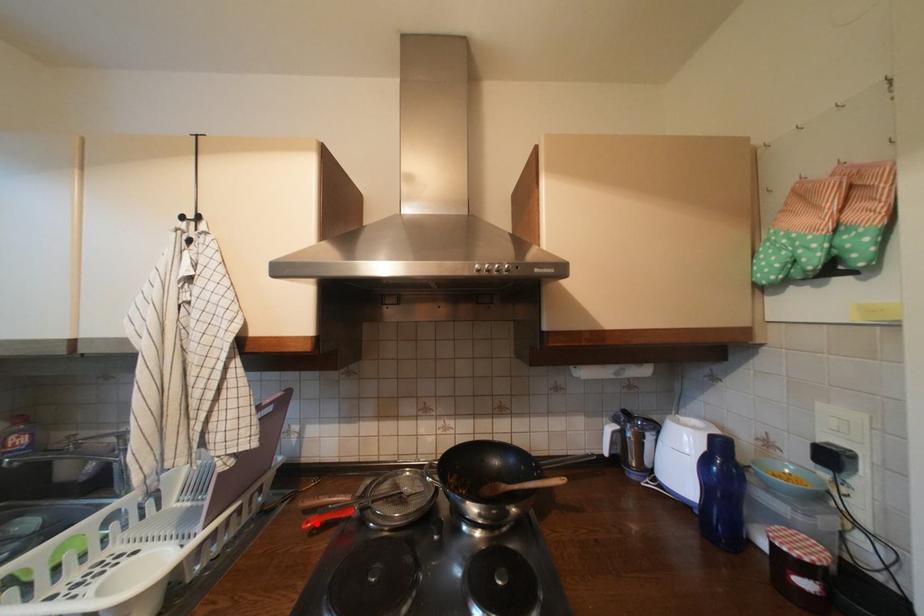
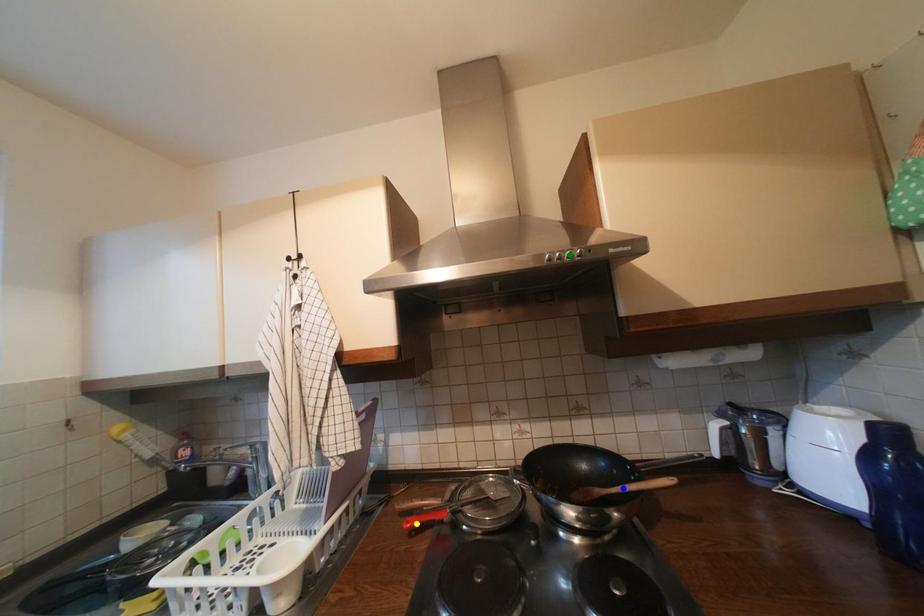
Question: I am providing you with two images of the same scene from different viewpoints. A red point is marked on the first image. You are given multiple points on the second image. Which point in image 2 represents the same 3d spot as the red point in image 1?

Choices:
 (A) yellow point
 (B) green point
 (C) blue point

Answer: (A)